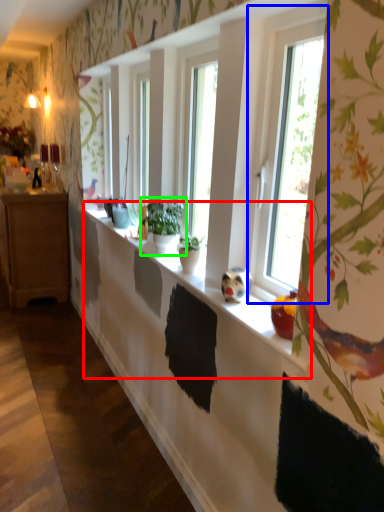
Question: Estimate the real-world distances between objects in this image. Which object is closer to window sill (highlighted by a red box), window (highlighted by a blue box) or houseplant (highlighted by a green box)?

Choices:
 (A) window
 (B) houseplant

Answer: (B)